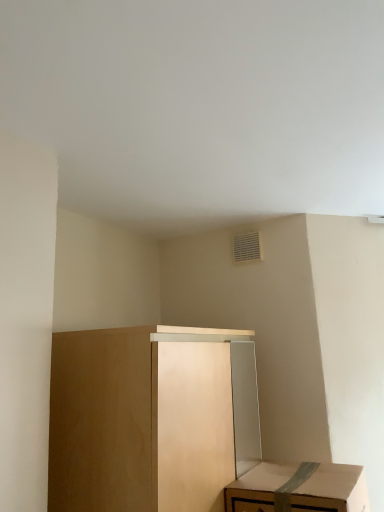
Question: Is matte wood cabinet at lower left aimed at cardboard box at lower right?

Choices:
 (A) yes
 (B) no

Answer: (A)

Question: Does matte wood cabinet at lower left have a larger size compared to cardboard box at lower right?

Choices:
 (A) yes
 (B) no

Answer: (A)

Question: Considering the relative sizes of matte wood cabinet at lower left and cardboard box at lower right in the image provided, is matte wood cabinet at lower left smaller than cardboard box at lower right?

Choices:
 (A) yes
 (B) no

Answer: (B)

Question: Is there a large distance between matte wood cabinet at lower left and cardboard box at lower right?

Choices:
 (A) yes
 (B) no

Answer: (B)

Question: From the image's perspective, is matte wood cabinet at lower left located beneath cardboard box at lower right?

Choices:
 (A) no
 (B) yes

Answer: (A)

Question: From a real-world perspective, is matte wood cabinet at lower left under cardboard box at lower right?

Choices:
 (A) yes
 (B) no

Answer: (B)

Question: From the image's perspective, would you say cardboard box at lower right is shown under matte wood cabinet at lower left?

Choices:
 (A) yes
 (B) no

Answer: (A)

Question: Does cardboard box at lower right have a lesser height compared to matte wood cabinet at lower left?

Choices:
 (A) no
 (B) yes

Answer: (B)

Question: From the image's perspective, would you say cardboard box at lower right is positioned over matte wood cabinet at lower left?

Choices:
 (A) no
 (B) yes

Answer: (A)

Question: Is cardboard box at lower right facing towards matte wood cabinet at lower left?

Choices:
 (A) yes
 (B) no

Answer: (B)

Question: Can you confirm if cardboard box at lower right is taller than matte wood cabinet at lower left?

Choices:
 (A) no
 (B) yes

Answer: (A)

Question: Is cardboard box at lower right at the left side of matte wood cabinet at lower left?

Choices:
 (A) yes
 (B) no

Answer: (B)

Question: From a real-world perspective, is cardboard box at lower right above or below matte wood cabinet at lower left?

Choices:
 (A) below
 (B) above

Answer: (A)